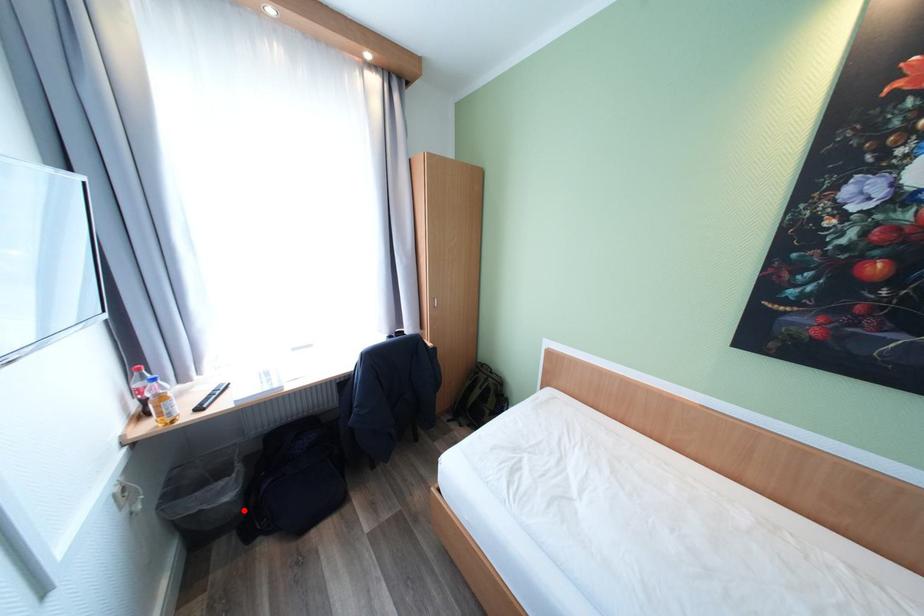
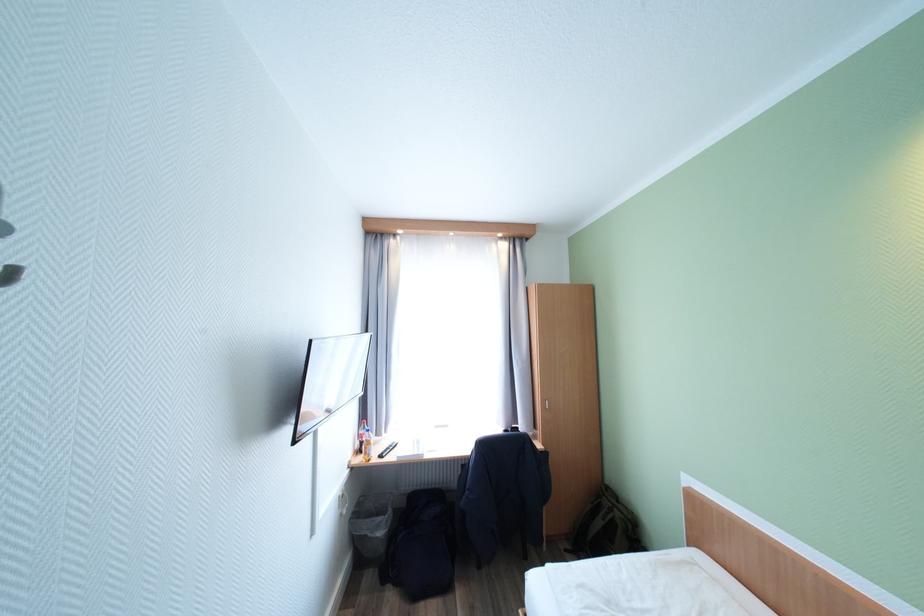
Find the pixel in the second image that matches the highlighted location in the first image.

(390, 551)